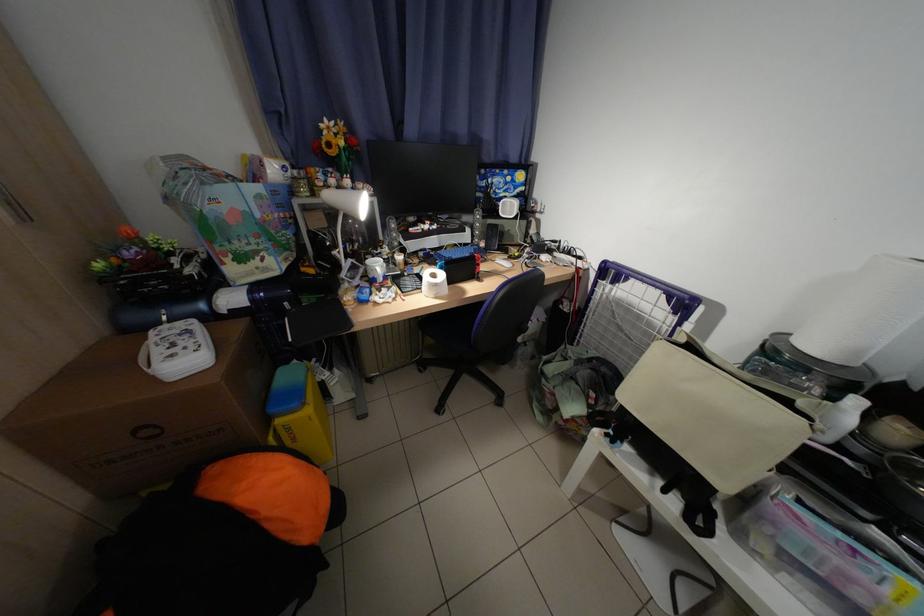
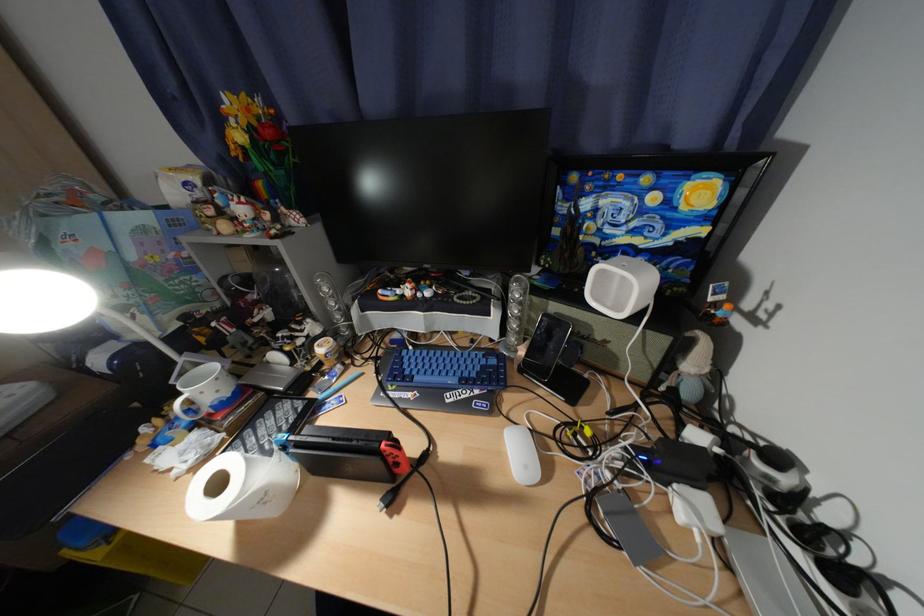
Find the pixel in the second image that matches pixel 544 233 in the first image.

(704, 367)